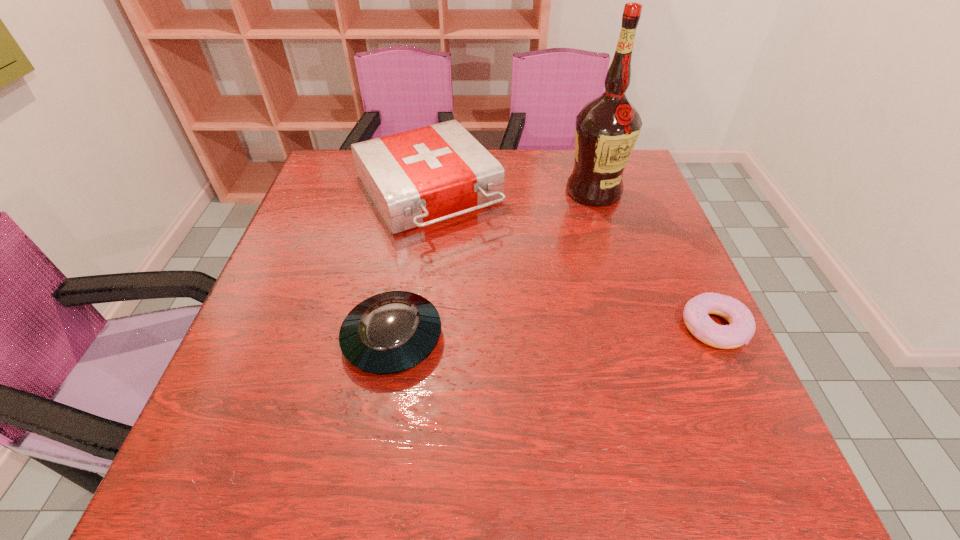
Where is `vacant point located between the tallest object and the first-aid kit`? The height and width of the screenshot is (540, 960). vacant point located between the tallest object and the first-aid kit is located at coordinates (511, 193).

Image resolution: width=960 pixels, height=540 pixels. Identify the location of vacant space in between the first-aid kit and the third object from left to right. click(x=511, y=193).

Locate an element on the screen. Image resolution: width=960 pixels, height=540 pixels. free space between the rightmost object and the saucer is located at coordinates (553, 333).

Locate an element on the screen. This screenshot has height=540, width=960. vacant space that is in between the second tallest object and the rightmost object is located at coordinates (570, 261).

Where is `free point between the saucer and the alcohol`? free point between the saucer and the alcohol is located at coordinates (493, 265).

Locate an element on the screen. empty location between the first-aid kit and the saucer is located at coordinates (410, 266).

I want to click on free space between the first-aid kit and the rightmost object, so click(x=570, y=261).

Locate an element on the screen. This screenshot has width=960, height=540. unoccupied position between the third object from left to right and the third tallest object is located at coordinates (493, 265).

In order to click on the second closest object relative to the saucer in this screenshot , I will do `click(606, 130)`.

Identify the location of object that is the closest to the saucer. The height and width of the screenshot is (540, 960). (416, 178).